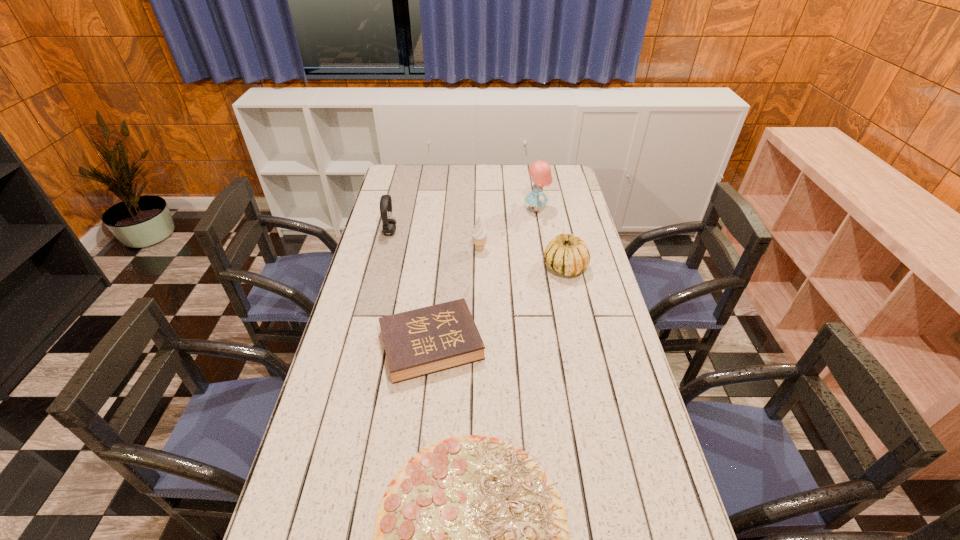
Locate an element on the screen. Image resolution: width=960 pixels, height=540 pixels. object that is the fourth closest to the leftmost object is located at coordinates (568, 254).

Identify the location of free location that satisfies the following two spatial constraints: 1. on the front-facing side of the leftmost object; 2. on the right side of the hardback book. The width and height of the screenshot is (960, 540). (361, 345).

Identify the location of free spot that satisfies the following two spatial constraints: 1. on the front-facing side of the gourd; 2. on the right side of the headset. The width and height of the screenshot is (960, 540). (381, 267).

Find the location of a particular element. The width and height of the screenshot is (960, 540). free space in the image that satisfies the following two spatial constraints: 1. on the front-facing side of the tallest object; 2. on the front-facing side of the icecream is located at coordinates (543, 250).